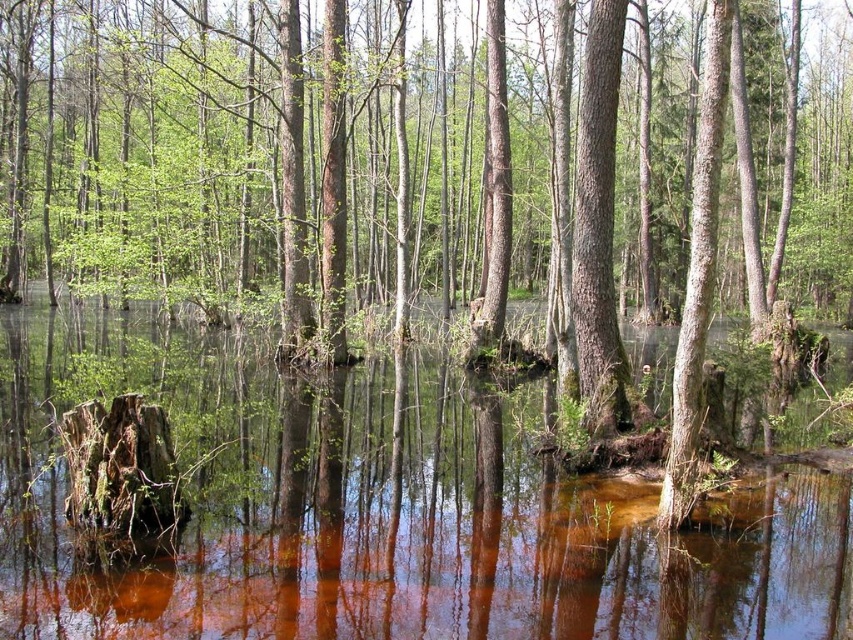
Question: Among these objects, which one is farthest from the camera?

Choices:
 (A) brown wood at center
 (B) smooth brown tree trunk at center

Answer: (B)

Question: From the image, what is the correct spatial relationship of brown wood at center in relation to smooth brown tree trunk at center?

Choices:
 (A) right
 (B) left

Answer: (B)

Question: Does brown wood at center appear on the left side of smooth brown tree trunk at center?

Choices:
 (A) yes
 (B) no

Answer: (A)

Question: Which object appears farthest from the camera in this image?

Choices:
 (A) smooth brown tree trunk at center
 (B) brown wood at center

Answer: (A)

Question: Is brown wood at center further to the viewer compared to smooth brown tree trunk at center?

Choices:
 (A) yes
 (B) no

Answer: (B)